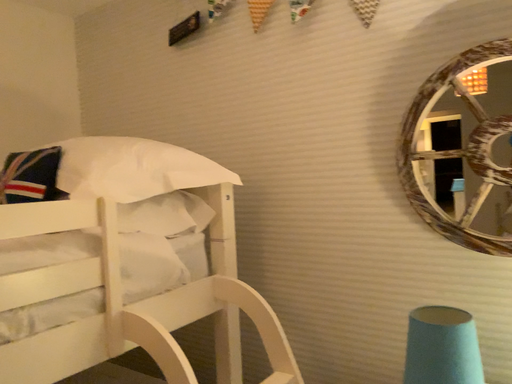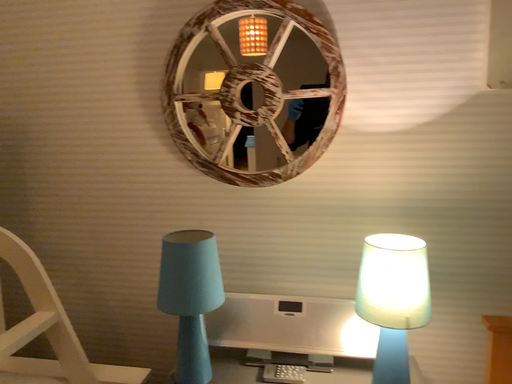
Question: How did the camera likely rotate when shooting the video?

Choices:
 (A) rotated left
 (B) rotated right

Answer: (B)